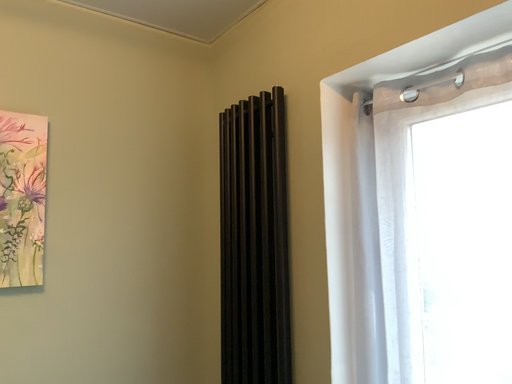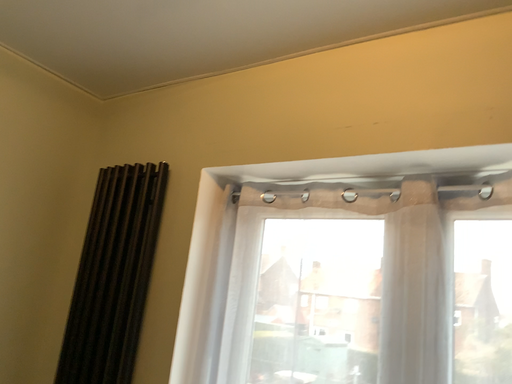
Question: Which way did the camera rotate in the video?

Choices:
 (A) rotated right
 (B) rotated left

Answer: (A)